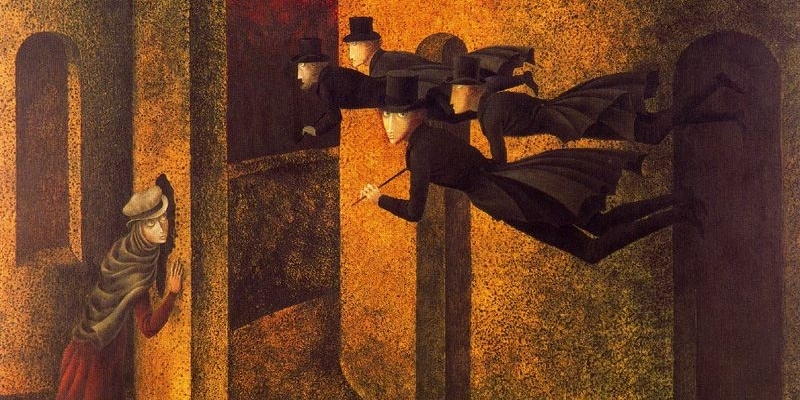
Identify the location of floor. (302, 381).